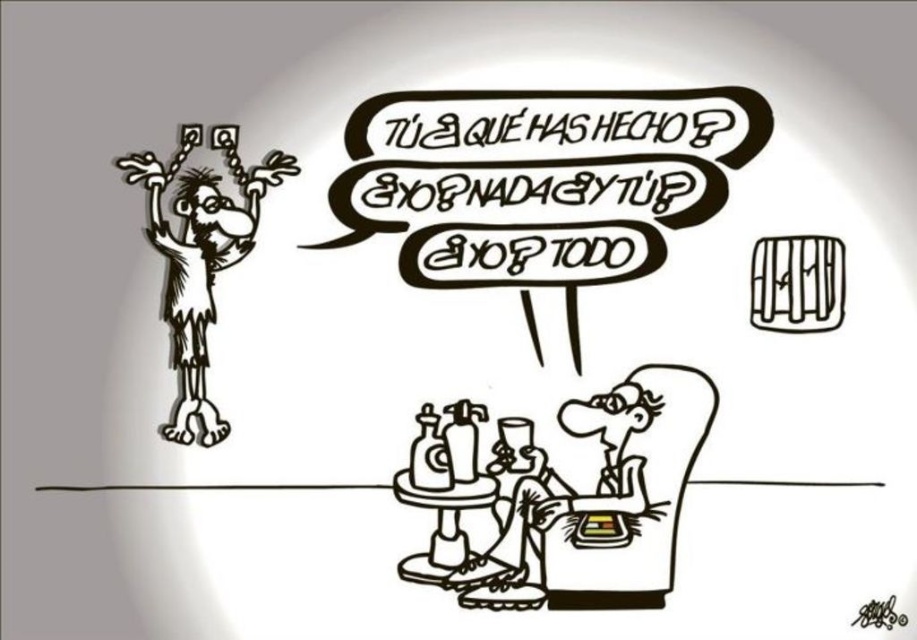
In the black and white cartoon scene, there is a black ink drawing of man at left and a smooth wood stool at lower center. Which object is wider?

The black ink drawing of man at left is wider than the smooth wood stool at lower center according to the description.

From the picture: In the black and white cartoon scene, there are two characters. The first is the black ink drawing of man at left, and the second is the smooth skin man at lower center. Which of these two characters has a smaller width?

The black ink drawing of man at left is thinner than the smooth skin man at lower center, so the black ink drawing of man at left has a smaller width.

You are a character in the image and want to move from your current position to the smooth skin man at lower center. According to the coordinates provided, in which direction should you move?

The smooth skin man at lower center is located at coordinates point (572, 492), so you should move towards the right and downward to reach him.